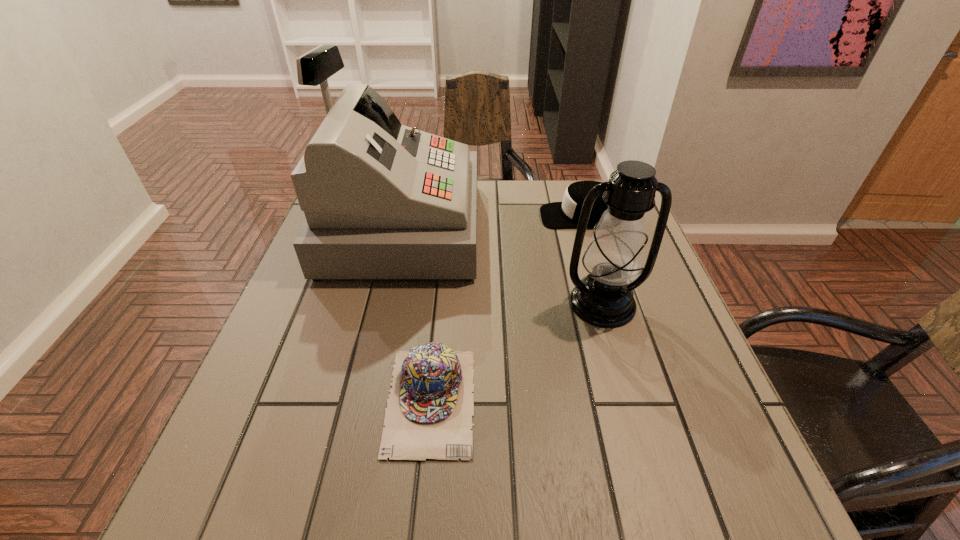
Locate an element on the screen. free space between the right cap and the shortest object is located at coordinates (506, 308).

Image resolution: width=960 pixels, height=540 pixels. I want to click on free space that is in between the shortest object and the second tallest object, so click(516, 352).

The width and height of the screenshot is (960, 540). In order to click on object that is the closest one to the taller cap in this screenshot , I will do `click(382, 200)`.

Locate an element on the screen. The width and height of the screenshot is (960, 540). object identified as the closest to the oil lamp is located at coordinates (382, 200).

The image size is (960, 540). I want to click on free point that satisfies the following two spatial constraints: 1. on the keypad side of the tallest object; 2. on the left side of the oil lamp, so click(383, 303).

You are a GUI agent. You are given a task and a screenshot of the screen. Output one action in this format:
    pyautogui.click(x=<x>, y=<y>)
    Task: Click on the free spot that satisfies the following two spatial constraints: 1. on the keypad side of the cash register; 2. on the left side of the oil lamp
    
    Given the screenshot: What is the action you would take?
    pyautogui.click(x=383, y=303)

At what (x,y) coordinates should I click in order to perform the action: click on blank area in the image that satisfies the following two spatial constraints: 1. on the keypad side of the third shortest object; 2. on the right side of the tallest object. Please return your answer as a coordinate pair (x, y). This screenshot has height=540, width=960. Looking at the image, I should click on (383, 303).

The width and height of the screenshot is (960, 540). I want to click on free space that satisfies the following two spatial constraints: 1. on the front-facing side of the taller cap; 2. on the front, side, and top of the shorter cap, so click(x=636, y=401).

Locate an element on the screen. The width and height of the screenshot is (960, 540). vacant space that satisfies the following two spatial constraints: 1. on the back side of the oil lamp; 2. on the keypad side of the cash register is located at coordinates (581, 228).

Find the location of a particular element. This screenshot has width=960, height=540. free space that satisfies the following two spatial constraints: 1. on the back side of the third shortest object; 2. on the keypad side of the cash register is located at coordinates pos(581,228).